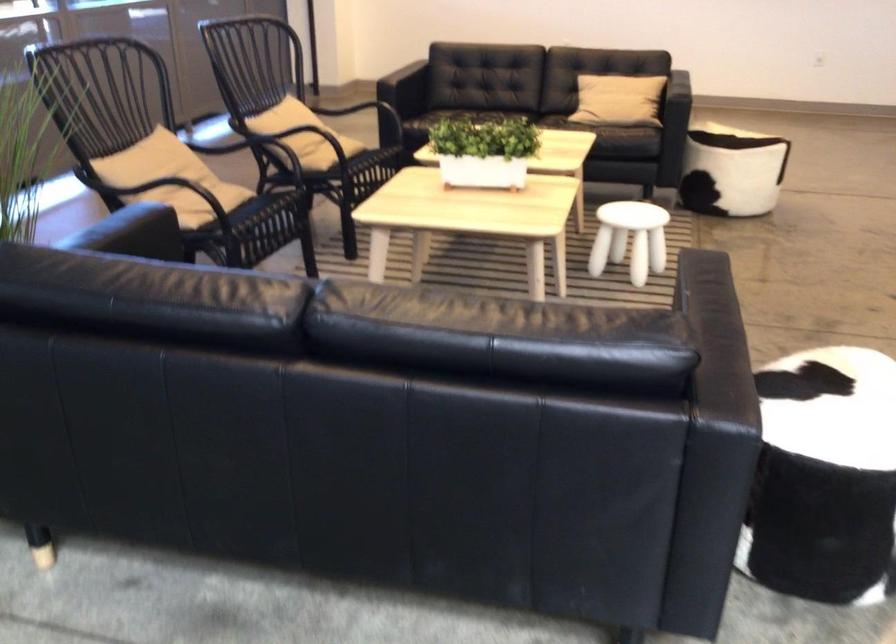
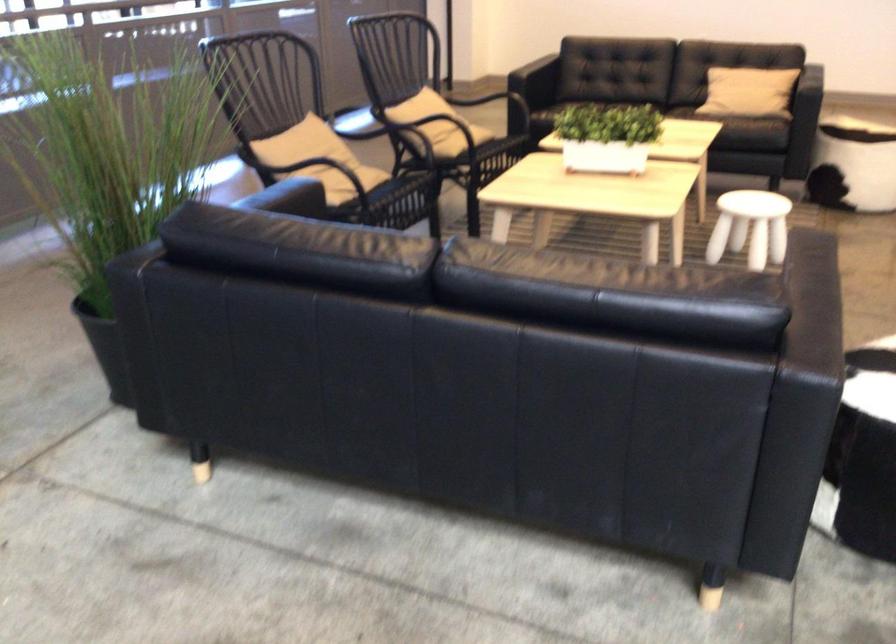
Find the pixel in the second image that matches (483,152) in the first image.

(607, 137)